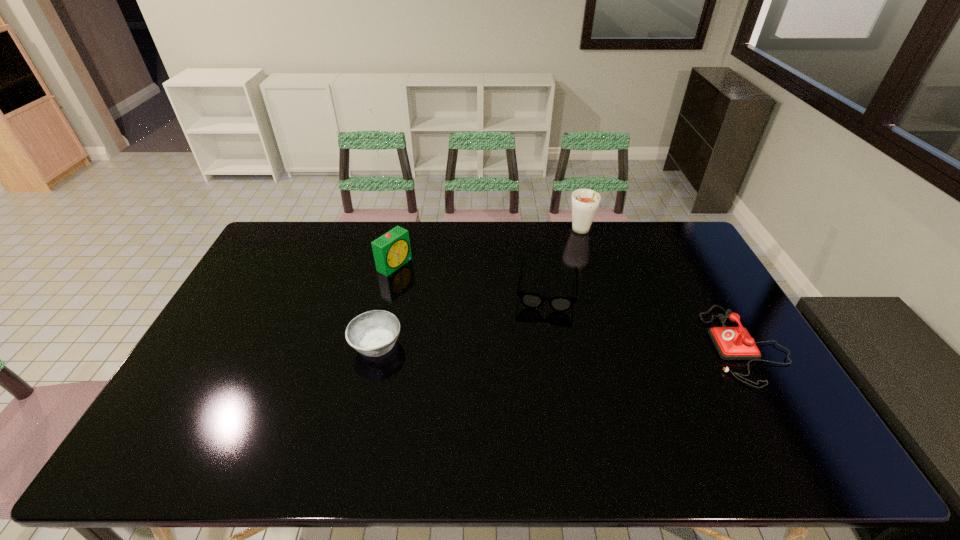
Find the location of a particular element. The image size is (960, 540). vacant space that satisfies the following two spatial constraints: 1. on the front side of the rightmost object; 2. on the dial of the alarm clock is located at coordinates (376, 345).

Locate an element on the screen. vacant space that satisfies the following two spatial constraints: 1. on the front side of the third shortest object; 2. on the dial of the third object from left to right is located at coordinates (556, 345).